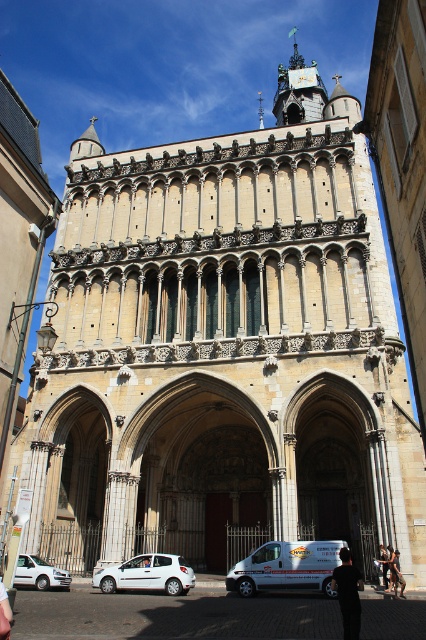
Question: Does white van at lower center have a lesser width compared to white matte hatchback at lower left?

Choices:
 (A) yes
 (B) no

Answer: (B)

Question: Which of the following is the closest to the observer?

Choices:
 (A) (181, 570)
 (B) (348, 589)
 (C) (23, 582)
 (D) (147, 556)

Answer: (B)

Question: Is white van at lower center above dark gray fabric pants at center?

Choices:
 (A) no
 (B) yes

Answer: (A)

Question: Considering the real-world distances, which object is closest to the white fabric person at center?

Choices:
 (A) white matte van at lower left
 (B) dark gray fabric pants at center
 (C) black fabric person at lower center

Answer: (A)

Question: Which is nearer to the white fabric person at center?

Choices:
 (A) black fabric person at lower center
 (B) white van at lower center
 (C) white matte hatchback at lower left

Answer: (C)

Question: Can you confirm if white van at lower center is positioned to the left of white fabric person at center?

Choices:
 (A) no
 (B) yes

Answer: (A)